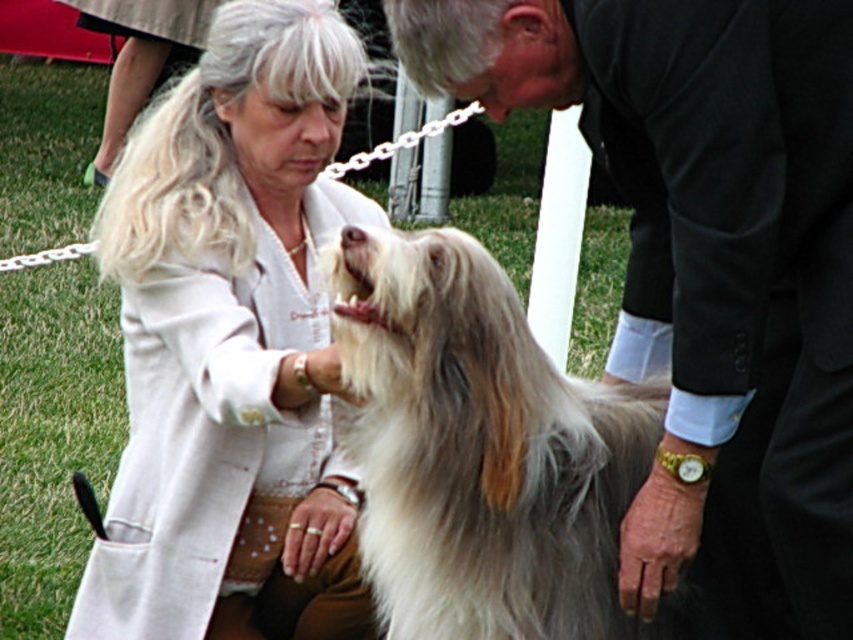
You are a photographer at a dog show and need to position the white textured coat at center and the fluffy white dog at center for a photo. Which object should be placed to the left to match the original scene?

The white textured coat at center should be placed to the left of the fluffy white dog at center because the white textured coat at center is positioned on the left side of the fluffy white dog at center in the original scene.